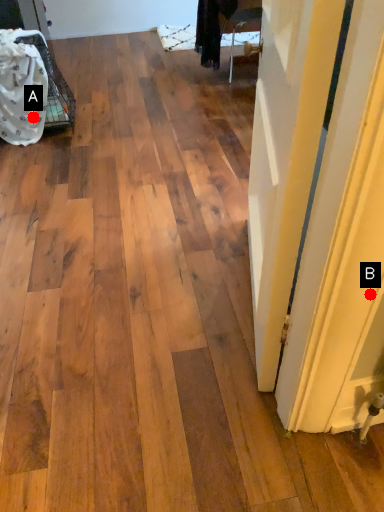
Question: Two points are circled on the image, labeled by A and B beside each circle. Which of the following is the farthest from the observer?

Choices:
 (A) A is further
 (B) B is further

Answer: (A)